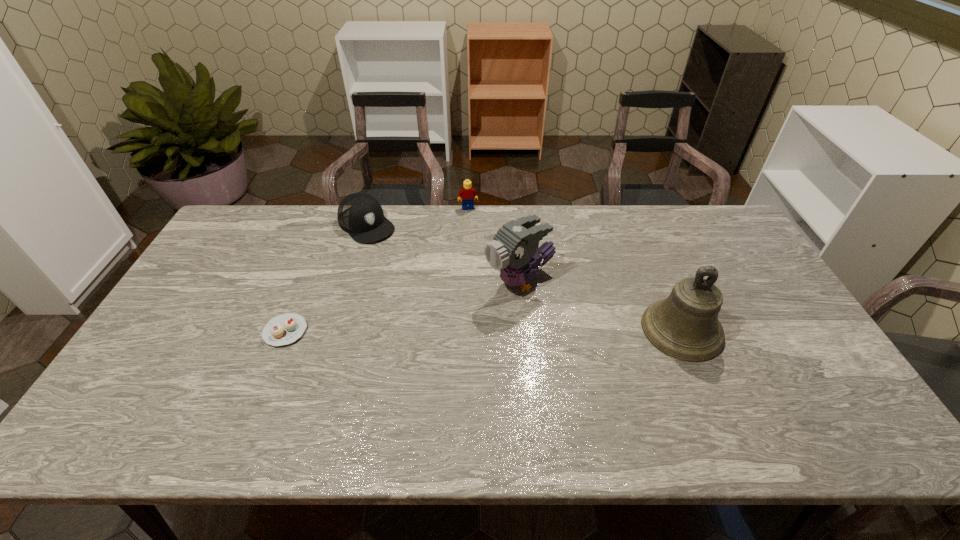
At what (x,y) coordinates should I click in order to perform the action: click on free space on the desktop that is between the cupcake and the bell and is positioned on the front-facing side of the Lego. Please return your answer as a coordinate pair (x, y). This screenshot has height=540, width=960. Looking at the image, I should click on (493, 330).

Find the location of a particular element. The width and height of the screenshot is (960, 540). vacant space on the desktop that is between the shortest object and the bell and is positioned at the beak of the fourth object from left to right is located at coordinates (436, 330).

Image resolution: width=960 pixels, height=540 pixels. I want to click on free space on the desktop that is between the cupcake and the bell and is positioned on the front-facing side of the cap, so click(x=469, y=330).